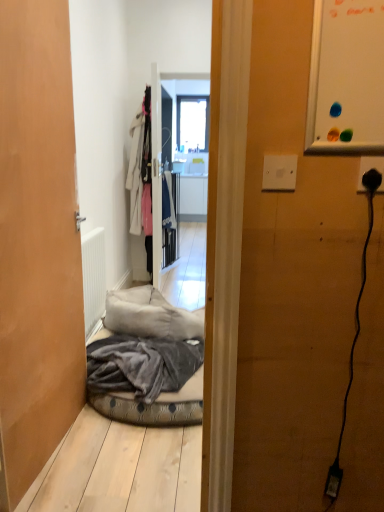
Question: Is transparent glass window at center not inside black plastic plug at right?

Choices:
 (A) yes
 (B) no

Answer: (A)

Question: Does transparent glass window at center come in front of black plastic plug at right?

Choices:
 (A) yes
 (B) no

Answer: (B)

Question: Considering the relative sizes of transparent glass window at center and black plastic plug at right in the image provided, is transparent glass window at center wider than black plastic plug at right?

Choices:
 (A) yes
 (B) no

Answer: (A)

Question: Is transparent glass window at center with black plastic plug at right?

Choices:
 (A) yes
 (B) no

Answer: (B)

Question: From a real-world perspective, does transparent glass window at center stand above black plastic plug at right?

Choices:
 (A) no
 (B) yes

Answer: (B)

Question: Does transparent glass window at center lie behind black plastic plug at right?

Choices:
 (A) no
 (B) yes

Answer: (B)

Question: Is white matte radiator at left thinner than white fabric coat at center?

Choices:
 (A) yes
 (B) no

Answer: (A)

Question: Is white matte radiator at left surrounding white fabric coat at center?

Choices:
 (A) yes
 (B) no

Answer: (B)

Question: Is white matte radiator at left oriented towards white fabric coat at center?

Choices:
 (A) no
 (B) yes

Answer: (A)

Question: Does white matte radiator at left appear on the right side of white fabric coat at center?

Choices:
 (A) yes
 (B) no

Answer: (B)

Question: Is white matte radiator at left with white fabric coat at center?

Choices:
 (A) yes
 (B) no

Answer: (B)

Question: From a real-world perspective, is white matte radiator at left on white fabric coat at center?

Choices:
 (A) yes
 (B) no

Answer: (B)

Question: Does white fabric coat at center appear on the right side of transparent glass window at center?

Choices:
 (A) no
 (B) yes

Answer: (A)